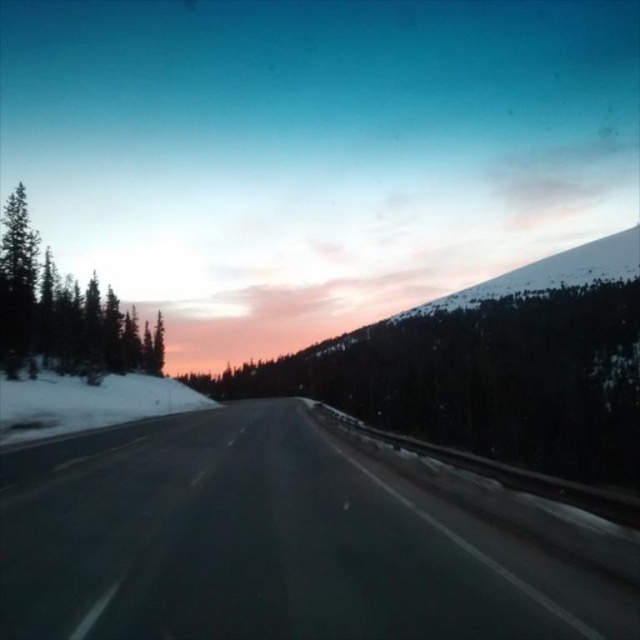
Question: Is black asphalt highway at center positioned before green matte tree at left?

Choices:
 (A) no
 (B) yes

Answer: (B)

Question: Is black asphalt highway at center below green matte tree at left?

Choices:
 (A) no
 (B) yes

Answer: (B)

Question: Which of the following is the closest to the observer?

Choices:
 (A) black asphalt highway at center
 (B) green matte tree at left

Answer: (A)

Question: Does black asphalt highway at center have a larger size compared to green matte tree at left?

Choices:
 (A) no
 (B) yes

Answer: (A)

Question: Which of the following is the closest to the observer?

Choices:
 (A) black asphalt highway at center
 (B) green matte tree at left

Answer: (A)